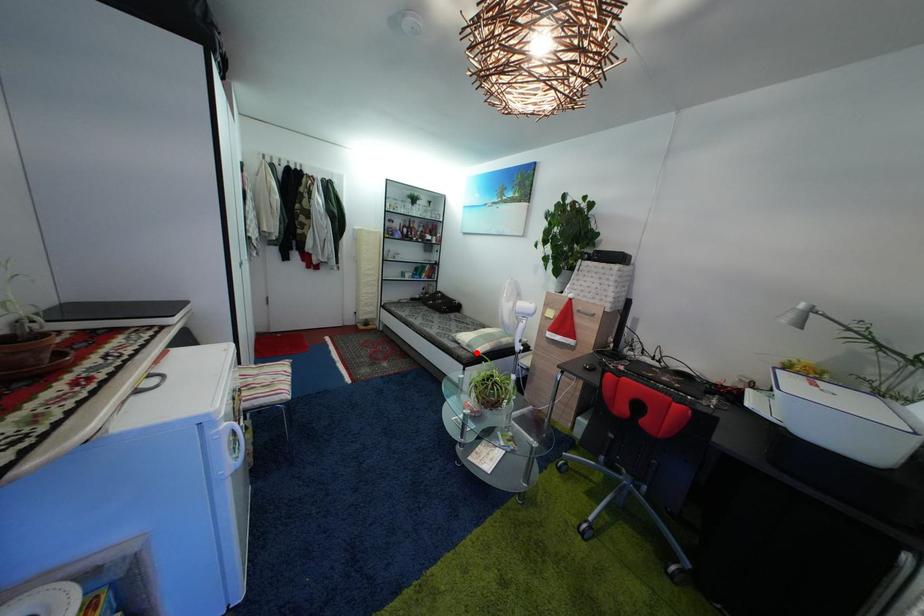
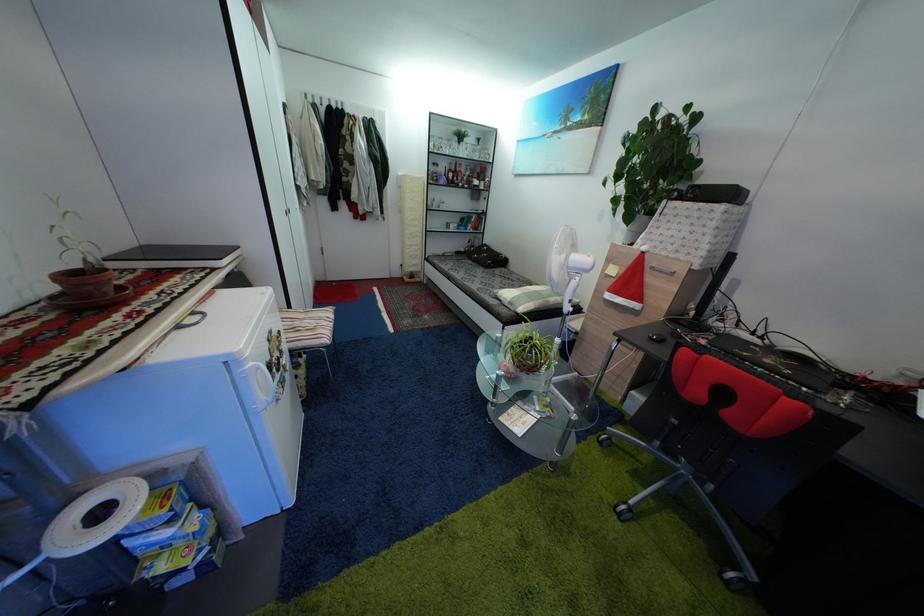
In the second image, find the point that corresponds to the highlighted location in the first image.

(517, 310)